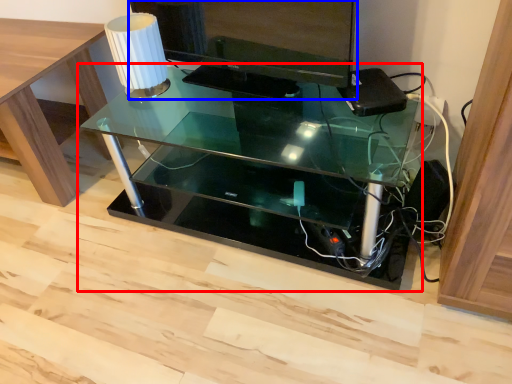
Question: Among these objects, which one is nearest to the camera, table (highlighted by a red box) or computer monitor (highlighted by a blue box)?

Choices:
 (A) table
 (B) computer monitor

Answer: (A)